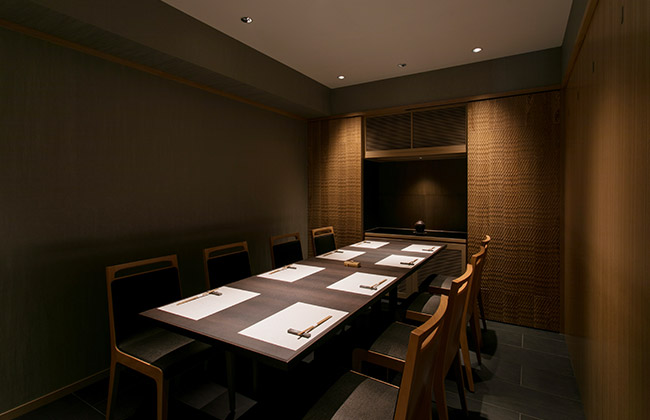
You are a GUI agent. You are given a task and a screenshot of the screen. Output one action in this format:
    pyautogui.click(x=<x>, y=<y>)
    Task: Click on the brown wood panelling
    
    Given the screenshot: What is the action you would take?
    pyautogui.click(x=573, y=292)